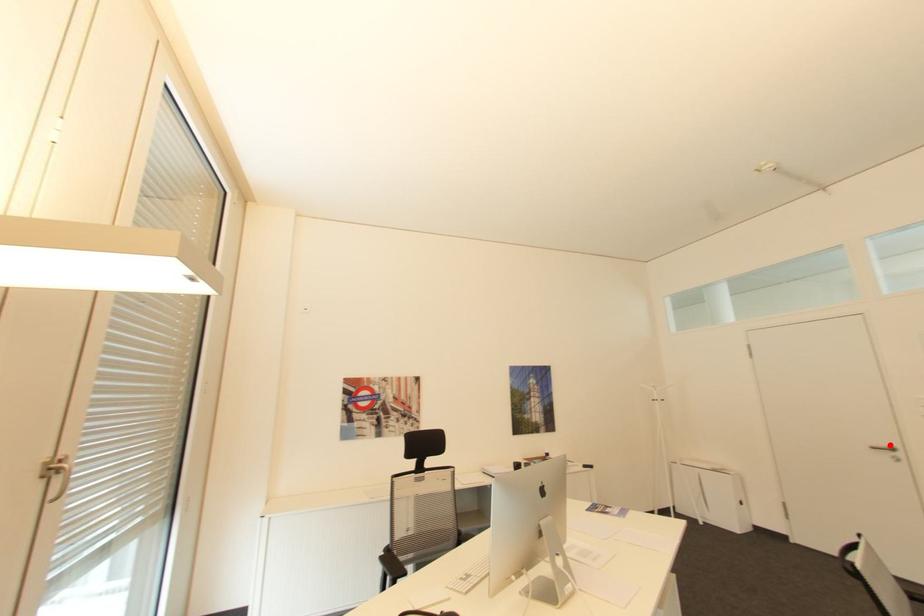
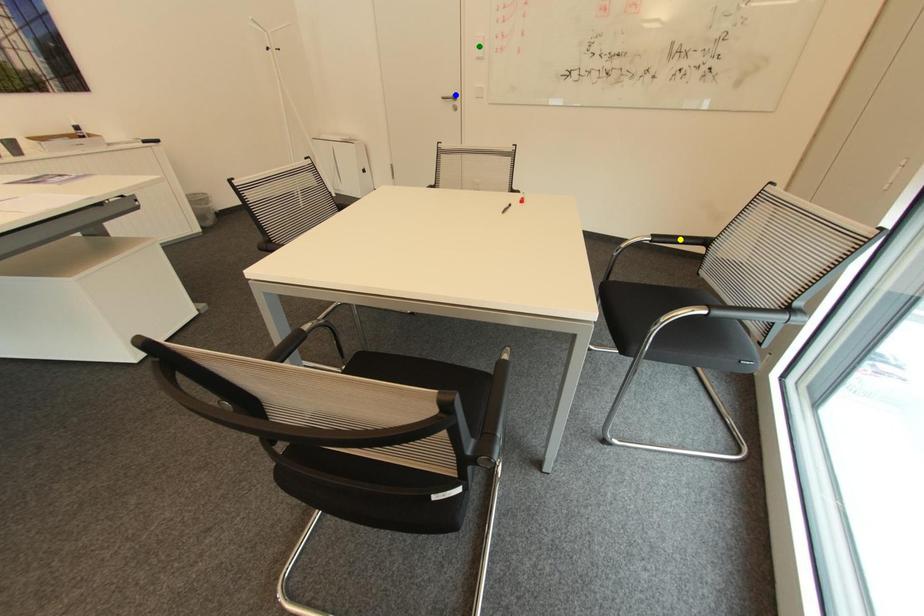
Question: I am providing you with two images of the same scene from different viewpoints. A red point is marked on the first image. You are given multiple points on the second image. In image 2, which mark is for the same physical point as the one in image 1?

Choices:
 (A) blue point
 (B) yellow point
 (C) green point

Answer: (A)